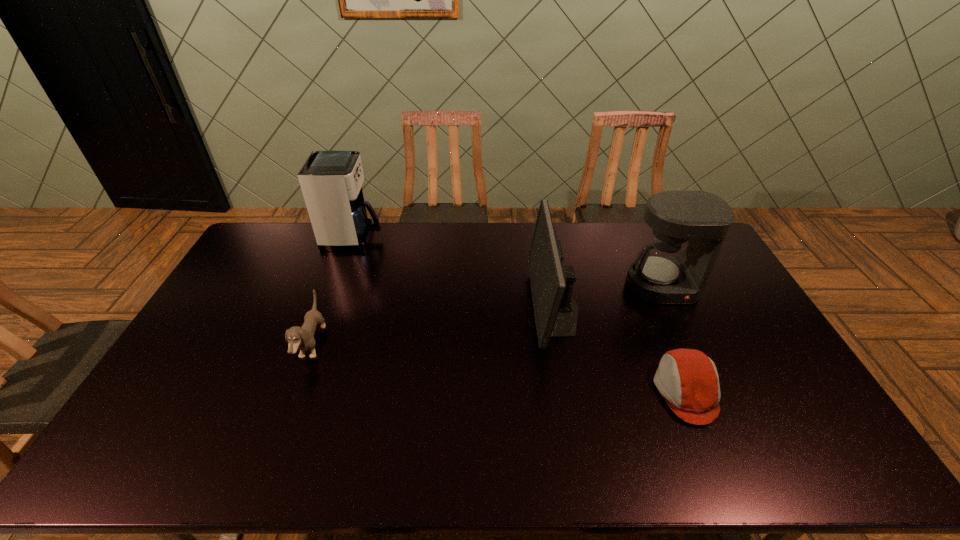
Identify the location of vacant space that's between the right coffee maker and the farther coffee maker. This screenshot has width=960, height=540. (508, 262).

Identify the location of free spot between the left coffee maker and the fourth tallest object. (333, 291).

The width and height of the screenshot is (960, 540). Identify the location of object that is the closest to the shortest object. (556, 312).

Where is `object that is the fourth nearest to the fourth tallest object`? The width and height of the screenshot is (960, 540). object that is the fourth nearest to the fourth tallest object is located at coordinates (665, 274).

Find the location of a particular element. The height and width of the screenshot is (540, 960). vacant space that satisfies the following two spatial constraints: 1. on the button side of the right coffee maker; 2. on the screen side of the computer monitor is located at coordinates (672, 308).

The image size is (960, 540). Identify the location of vacant area in the image that satisfies the following two spatial constraints: 1. on the button side of the right coffee maker; 2. on the front-facing side of the cap. (710, 392).